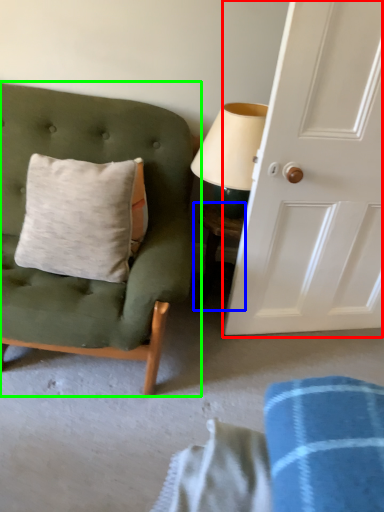
Question: Based on their relative distances, which object is farther from door (highlighted by a red box)? Choose from table (highlighted by a blue box) and chair (highlighted by a green box).

Choices:
 (A) table
 (B) chair

Answer: (B)